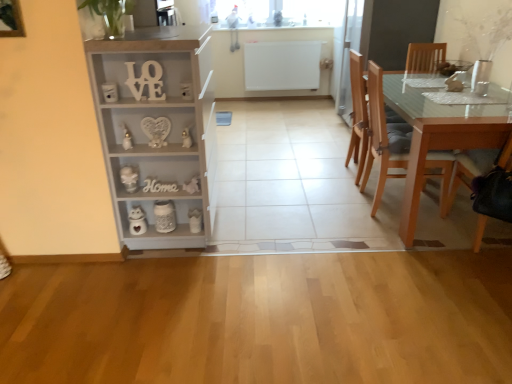
Image resolution: width=512 pixels, height=384 pixels. In order to click on vacant region above light brown wooden table at right (from a real-world perspective) in this screenshot , I will do `click(454, 99)`.